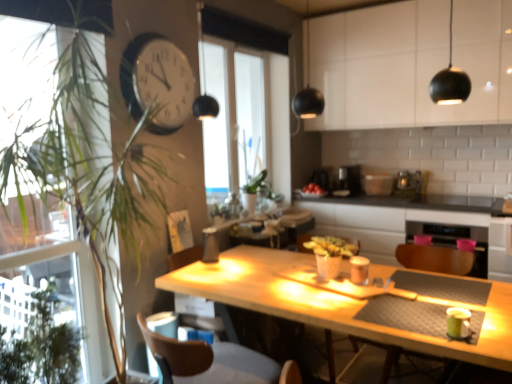
Question: Could you tell me if green leafy plant at left is facing brown leather swivel chair at lower left?

Choices:
 (A) no
 (B) yes

Answer: (A)

Question: From the image's perspective, would you say green leafy plant at left is shown under brown leather swivel chair at lower left?

Choices:
 (A) yes
 (B) no

Answer: (B)

Question: From a real-world perspective, does green leafy plant at left sit lower than brown leather swivel chair at lower left?

Choices:
 (A) yes
 (B) no

Answer: (B)

Question: Is green leafy plant at left further to camera compared to brown leather swivel chair at lower left?

Choices:
 (A) yes
 (B) no

Answer: (A)

Question: Can you confirm if green leafy plant at left is taller than brown leather swivel chair at lower left?

Choices:
 (A) yes
 (B) no

Answer: (A)

Question: Does green leafy plant at left appear on the right side of brown leather swivel chair at lower left?

Choices:
 (A) yes
 (B) no

Answer: (B)

Question: Is white glossy cabinet at upper center behind black matte counter at center?

Choices:
 (A) yes
 (B) no

Answer: (B)

Question: Does white glossy cabinet at upper center have a greater height compared to black matte counter at center?

Choices:
 (A) yes
 (B) no

Answer: (A)

Question: Considering the relative sizes of white glossy cabinet at upper center and black matte counter at center in the image provided, is white glossy cabinet at upper center bigger than black matte counter at center?

Choices:
 (A) no
 (B) yes

Answer: (A)

Question: From the image's perspective, is white glossy cabinet at upper center under black matte counter at center?

Choices:
 (A) no
 (B) yes

Answer: (A)

Question: Is white glossy cabinet at upper center closer to the viewer compared to black matte counter at center?

Choices:
 (A) no
 (B) yes

Answer: (B)

Question: From the image's perspective, does white glossy cabinet at upper center appear higher than black matte counter at center?

Choices:
 (A) no
 (B) yes

Answer: (B)

Question: From a real-world perspective, is green leafy plant at left located higher than satin silver toaster at center, marked as the second appliance in a left-to-right arrangement?

Choices:
 (A) no
 (B) yes

Answer: (A)